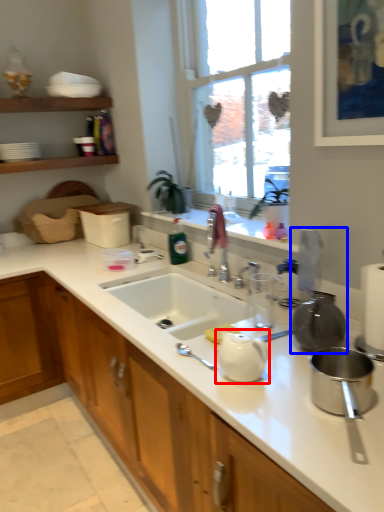
Question: Which object is closer to the camera taking this photo, tea pot (highlighted by a red box) or appliance (highlighted by a blue box)?

Choices:
 (A) tea pot
 (B) appliance

Answer: (A)